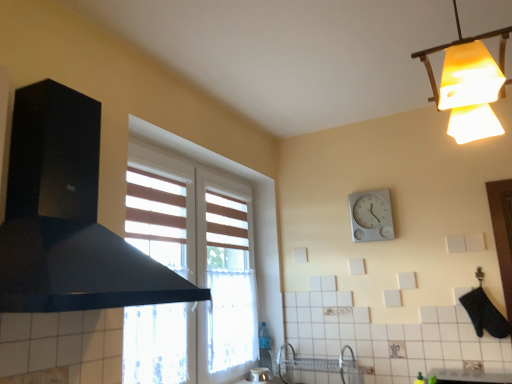
Question: From the image's perspective, relative to white plastic wall clock at upper center, is yellow frosted glass lampshade at upper right above or below?

Choices:
 (A) below
 (B) above

Answer: (B)

Question: From a real-world perspective, is yellow frosted glass lampshade at upper right above or below white plastic wall clock at upper center?

Choices:
 (A) below
 (B) above

Answer: (B)

Question: Considering the real-world distances, which object is farthest from the white plastic wall clock at upper center?

Choices:
 (A) black matte exhaust hood at left
 (B) white glossy countertop at lower center
 (C) yellow frosted glass lampshade at upper right

Answer: (A)

Question: Considering the real-world distances, which object is farthest from the yellow frosted glass lampshade at upper right?

Choices:
 (A) white glossy countertop at lower center
 (B) black matte exhaust hood at left
 (C) white plastic wall clock at upper center

Answer: (A)